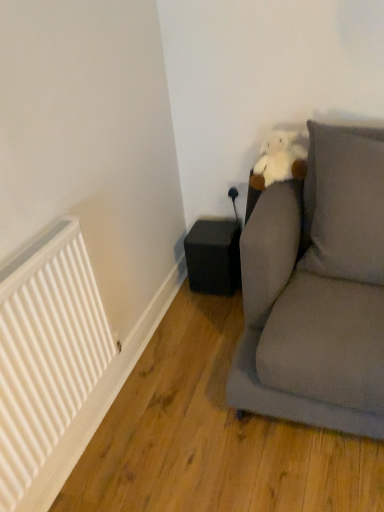
Question: Would you say black matte speaker at lower center is to the left or to the right of white matte radiator at left in the picture?

Choices:
 (A) left
 (B) right

Answer: (B)

Question: Looking at their shapes, would you say black matte speaker at lower center is wider or thinner than white matte radiator at left?

Choices:
 (A) thin
 (B) wide

Answer: (B)

Question: Which is nearer to the black matte speaker at lower center?

Choices:
 (A) gray fabric pillow at upper right
 (B) white matte radiator at left

Answer: (A)

Question: Which of these objects is positioned closest to the gray fabric pillow at upper right?

Choices:
 (A) black matte speaker at lower center
 (B) white matte radiator at left

Answer: (A)